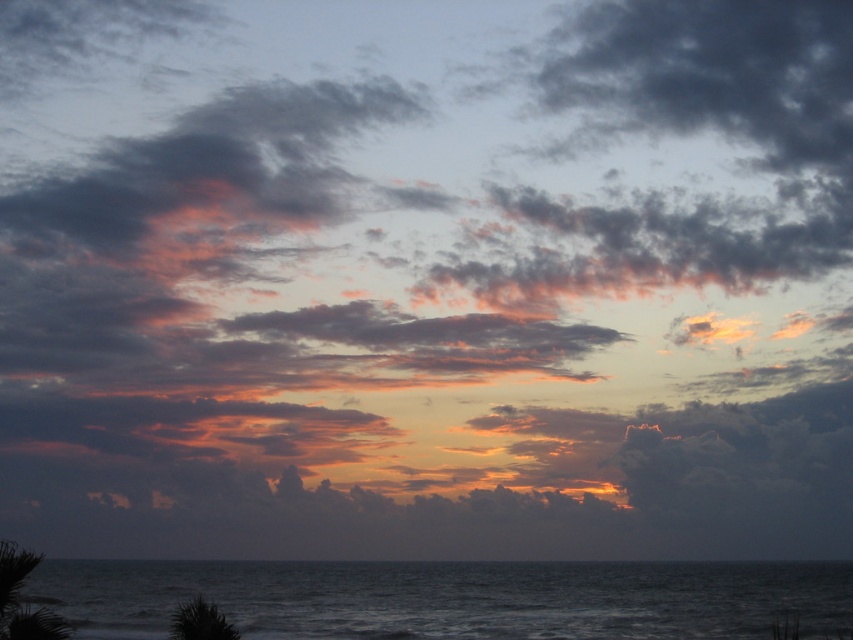
Between dark blue water at lower center and green leafy palm tree at lower left, which one is positioned higher?

green leafy palm tree at lower left

Can you confirm if dark blue water at lower center is bigger than green leafy palm tree at lower left?

Indeed, dark blue water at lower center has a larger size compared to green leafy palm tree at lower left.

Where is `dark blue water at lower center`? Image resolution: width=853 pixels, height=640 pixels. dark blue water at lower center is located at coordinates (450, 598).